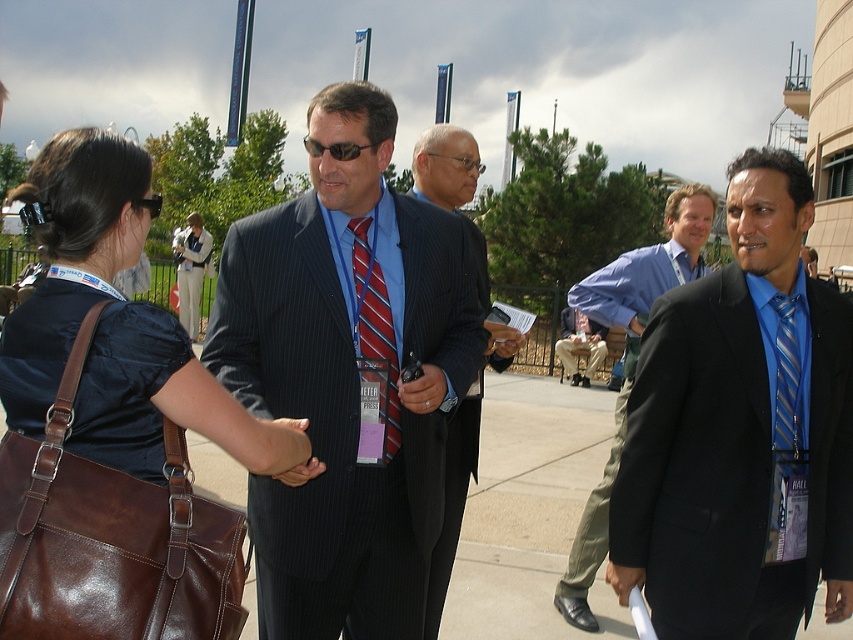
Question: Which of the following is the closest to the observer?

Choices:
 (A) blue silk suit at center
 (B) dark blue pinstripe suit at center
 (C) blue striped tie at center

Answer: (C)

Question: Estimate the real-world distances between objects in this image. Which object is farther from the blue striped tie at center?

Choices:
 (A) blue silk suit at center
 (B) brown leather bag at center
 (C) striped fabric tie at center

Answer: (B)

Question: Is blue silk suit at center wider than dark blue pinstripe suit at center?

Choices:
 (A) yes
 (B) no

Answer: (A)

Question: Does brown leather bag at center appear on the left side of striped fabric tie at center?

Choices:
 (A) yes
 (B) no

Answer: (A)

Question: Does matte black suit at center come in front of blue striped tie at center?

Choices:
 (A) yes
 (B) no

Answer: (A)

Question: Which point appears closest to the camera in this image?

Choices:
 (A) (136, 518)
 (B) (618, 483)
 (C) (639, 272)

Answer: (A)